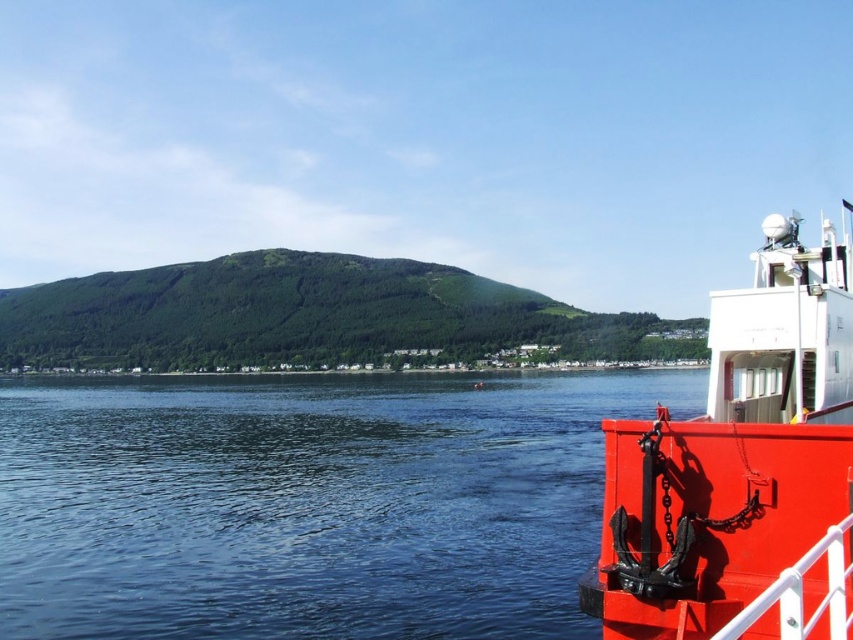
You are standing on the ferry and want to get a clear view of the water. Where should you look to see the clear water at lower right?

The clear water at lower right is located at point [308,502], so you should look towards that coordinate to see it.

You are an observer standing on the shore looking at the scene. Which object, the metallic red boat at right or the green forested hill at center, appears taller from your viewpoint?

The green forested hill at center appears taller than the metallic red boat at right from your viewpoint.

You are standing on the shore looking at the scene. Which object is closer to you, the clear water at lower right or the metallic red boat at right?

The clear water at lower right is closer to you because it is further to the viewer than the metallic red boat at right.